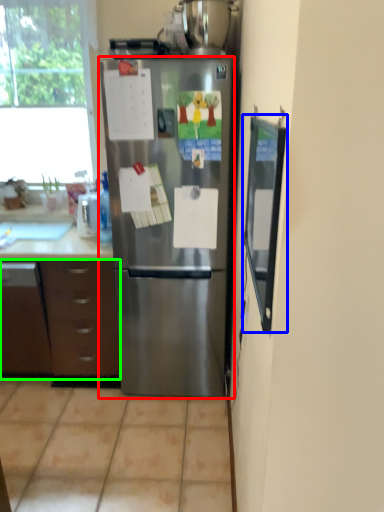
Question: Which object is positioned farthest from refrigerator (highlighted by a red box)? Select from screen door (highlighted by a blue box) and cabinetry (highlighted by a green box).

Choices:
 (A) screen door
 (B) cabinetry

Answer: (A)